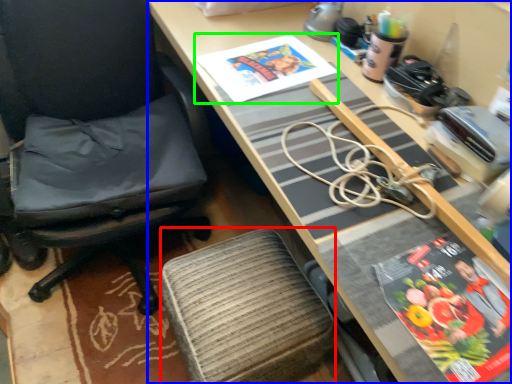
Question: Based on their relative distances, which object is farther from stool (highlighted by a red box)? Choose from desk (highlighted by a blue box) and book cover (highlighted by a green box).

Choices:
 (A) desk
 (B) book cover

Answer: (B)